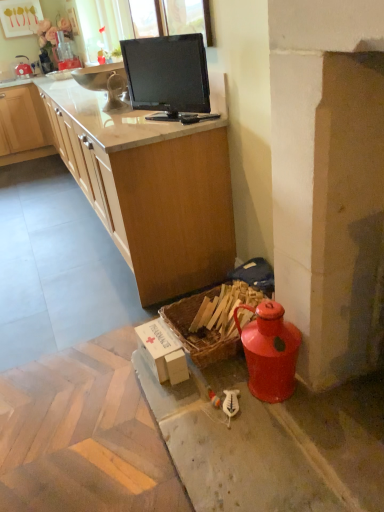
Question: Would you say matte wood countertop at upper center is a long distance from white cardboard box at lower center?

Choices:
 (A) no
 (B) yes

Answer: (A)

Question: Is white cardboard box at lower center inside matte wood countertop at upper center?

Choices:
 (A) yes
 (B) no

Answer: (B)

Question: Can you see matte wood countertop at upper center touching white cardboard box at lower center?

Choices:
 (A) yes
 (B) no

Answer: (B)

Question: Is matte wood countertop at upper center not within white cardboard box at lower center?

Choices:
 (A) no
 (B) yes

Answer: (B)

Question: From a real-world perspective, does matte wood countertop at upper center sit lower than white cardboard box at lower center?

Choices:
 (A) yes
 (B) no

Answer: (B)

Question: Is white cardboard box at lower center inside the boundaries of matte wood countertop at upper center, or outside?

Choices:
 (A) inside
 (B) outside

Answer: (B)

Question: Is white cardboard box at lower center bigger or smaller than matte wood countertop at upper center?

Choices:
 (A) small
 (B) big

Answer: (A)

Question: In the image, is white cardboard box at lower center positioned in front of or behind matte wood countertop at upper center?

Choices:
 (A) behind
 (B) front

Answer: (B)

Question: From the image's perspective, relative to matte wood countertop at upper center, is white cardboard box at lower center above or below?

Choices:
 (A) below
 (B) above

Answer: (A)

Question: Visually, is black glossy monitor at upper center positioned to the left or to the right of white cardboard box at lower center?

Choices:
 (A) right
 (B) left

Answer: (A)

Question: Is black glossy monitor at upper center in front of or behind white cardboard box at lower center in the image?

Choices:
 (A) front
 (B) behind

Answer: (B)

Question: Is point (163, 59) positioned closer to the camera than point (160, 330)?

Choices:
 (A) closer
 (B) farther

Answer: (B)

Question: From a real-world perspective, is black glossy monitor at upper center physically located above or below white cardboard box at lower center?

Choices:
 (A) above
 (B) below

Answer: (A)

Question: From the image's perspective, relative to white cardboard box at lower center, is woven wood picnic basket at lower right above or below?

Choices:
 (A) below
 (B) above

Answer: (B)

Question: Choose the correct answer: Is woven wood picnic basket at lower right inside white cardboard box at lower center or outside it?

Choices:
 (A) inside
 (B) outside

Answer: (B)